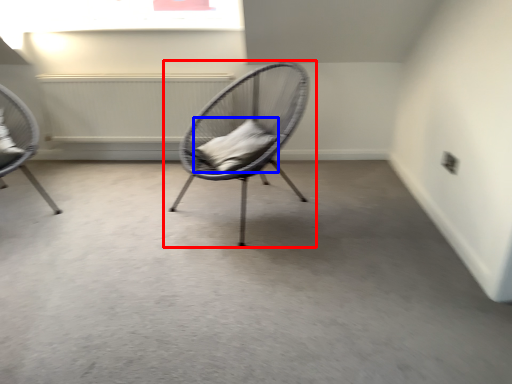
Question: Which of the following is the farthest to the observer, chair (highlighted by a red box) or pillow (highlighted by a blue box)?

Choices:
 (A) chair
 (B) pillow

Answer: (B)